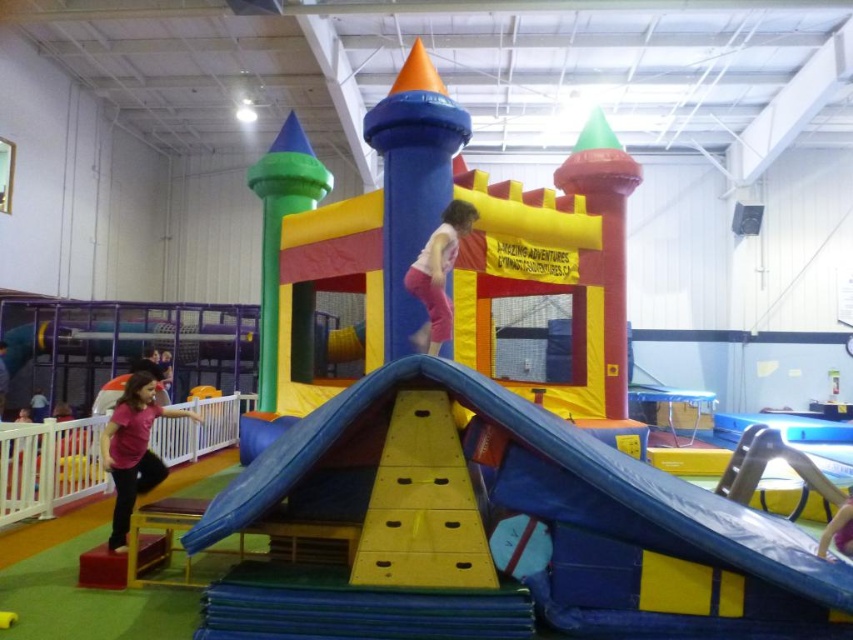
In the scene shown: You are standing at the center of the play area and want to locate the pink matte shirt at lower left. Based on the coordinates provided, in which direction should you look to find it?

The pink matte shirt at lower left is located at coordinates point (132,449), so you should look to the lower left direction to find it.